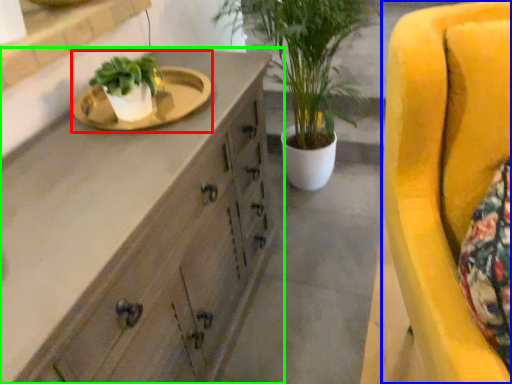
Question: Which object is the closest to the sink (highlighted by a red box)? Choose among these: chair (highlighted by a blue box) or cabinetry (highlighted by a green box).

Choices:
 (A) chair
 (B) cabinetry

Answer: (B)